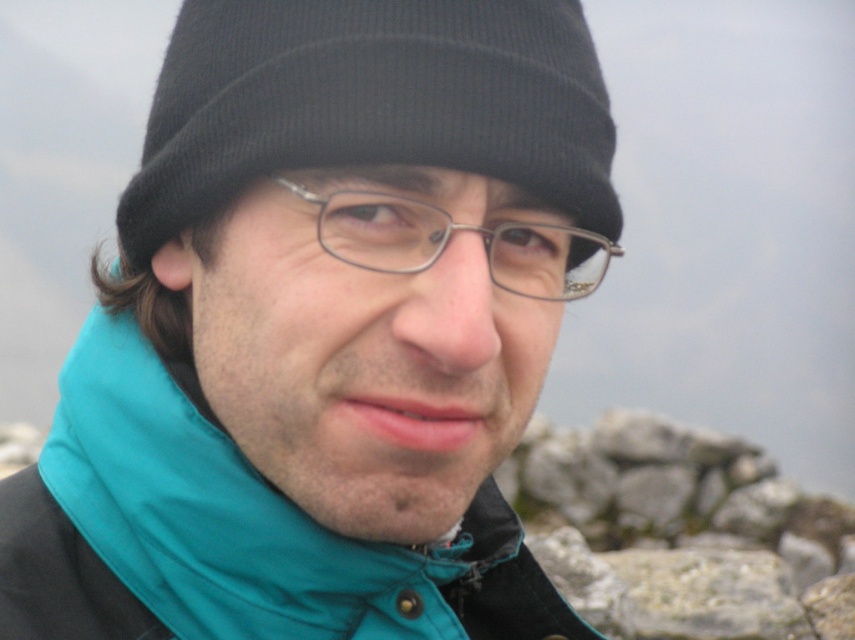
You are a photographer trying to capture the subject wearing the black knit hat at upper center and metallic rectangular glasses at center. Which object is located to the left of the other?

The black knit hat at upper center is positioned on the left side of metallic rectangular glasses at center.

You are a photographer trying to capture the subject wearing the teal fabric jacket at center and the black knit hat at upper center. To ensure both items are in focus, where should you focus your camera?

You should focus your camera on the black knit hat at upper center because it is closer to the camera than the teal fabric jacket at center, which is positioned underneath it.

You are a photographer adjusting your camera settings to focus on the subject in the image. Since the teal fabric jacket at center and the metallic rectangular glasses at center are both in the frame, which one is positioned lower relative to the other?

The teal fabric jacket at center is located below metallic rectangular glasses at center, so the teal fabric jacket at center is positioned lower than the metallic rectangular glasses at center.